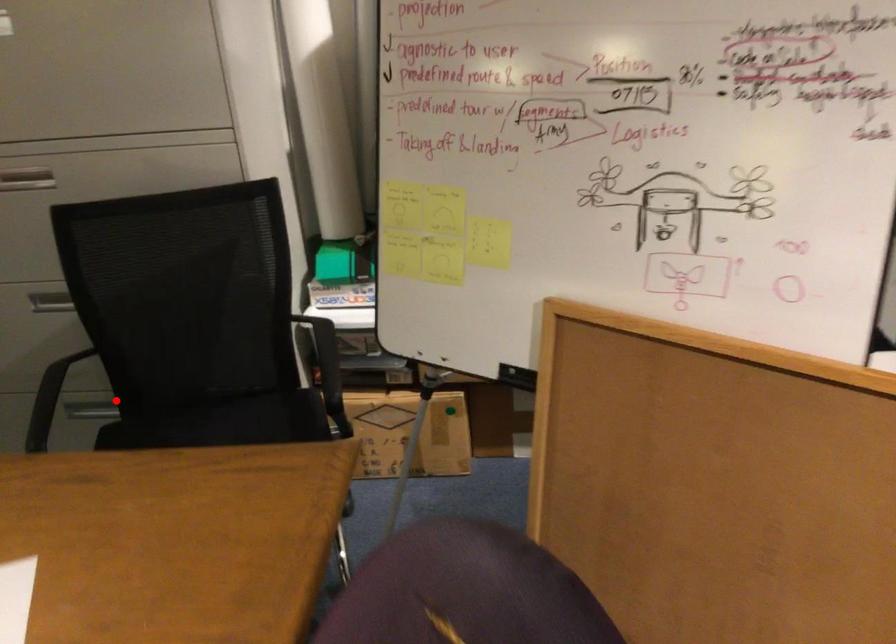
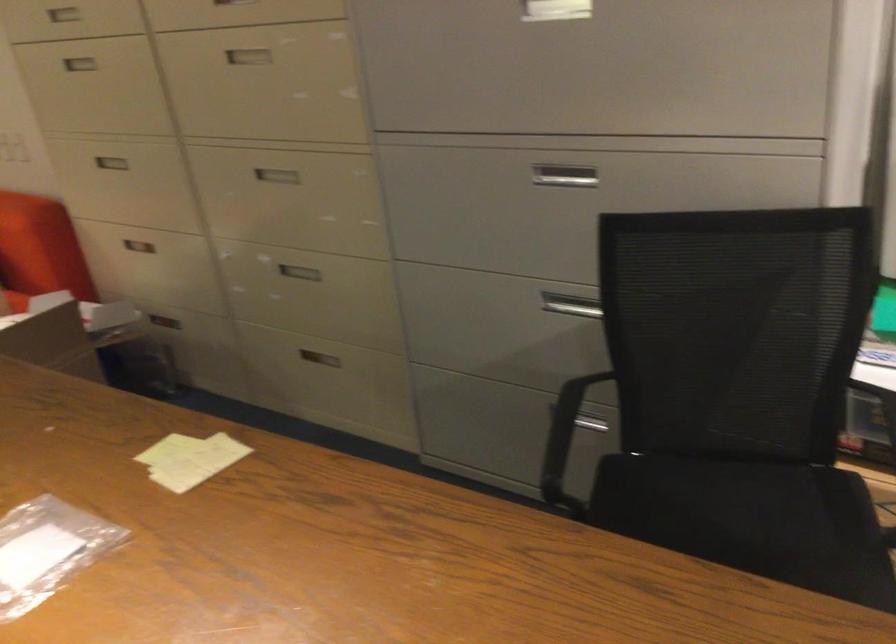
In the second image, find the point that corresponds to the highlighted location in the first image.

(599, 410)